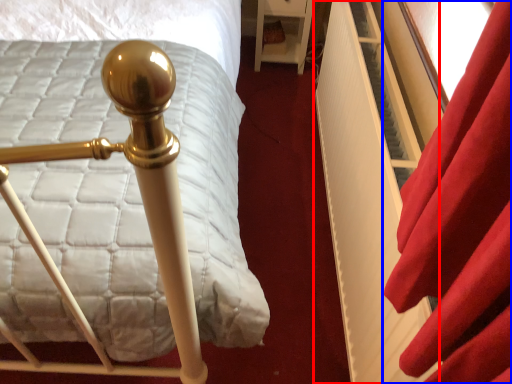
Question: Which of the following is the closest to the observer, bed frame (highlighted by a red box) or curtain (highlighted by a blue box)?

Choices:
 (A) bed frame
 (B) curtain

Answer: (B)